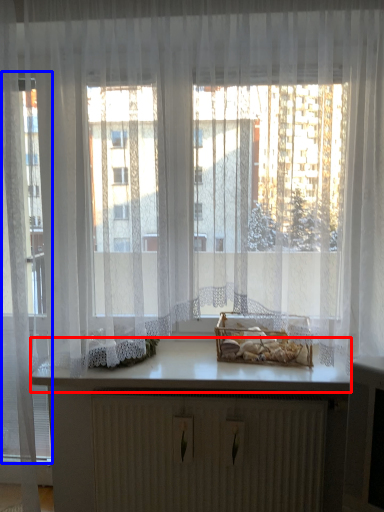
Question: Which of the following is the farthest to the observer, counter top (highlighted by a red box) or glass door (highlighted by a blue box)?

Choices:
 (A) counter top
 (B) glass door

Answer: (A)